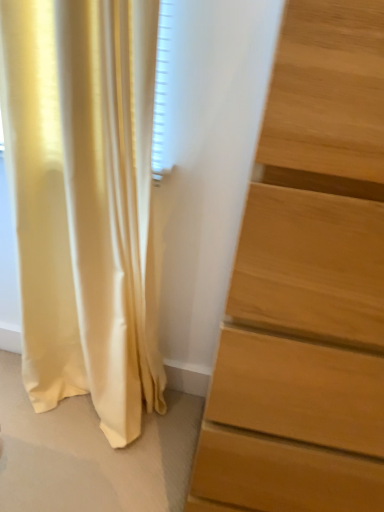
Question: From the image's perspective, relative to light brown wooden chest of drawers at right, is satin yellow curtain at left above or below?

Choices:
 (A) above
 (B) below

Answer: (A)

Question: Considering their positions, is satin yellow curtain at left located in front of or behind light brown wooden chest of drawers at right?

Choices:
 (A) behind
 (B) front

Answer: (A)

Question: Is satin yellow curtain at left inside or outside of light brown wooden chest of drawers at right?

Choices:
 (A) outside
 (B) inside

Answer: (A)

Question: From a real-world perspective, is light brown wooden chest of drawers at right positioned above or below satin yellow curtain at left?

Choices:
 (A) below
 (B) above

Answer: (B)

Question: Looking at the image, does light brown wooden chest of drawers at right seem bigger or smaller compared to satin yellow curtain at left?

Choices:
 (A) small
 (B) big

Answer: (B)

Question: Is light brown wooden chest of drawers at right in front of or behind satin yellow curtain at left in the image?

Choices:
 (A) front
 (B) behind

Answer: (A)

Question: From the image's perspective, is light brown wooden chest of drawers at right positioned above or below satin yellow curtain at left?

Choices:
 (A) below
 (B) above

Answer: (A)